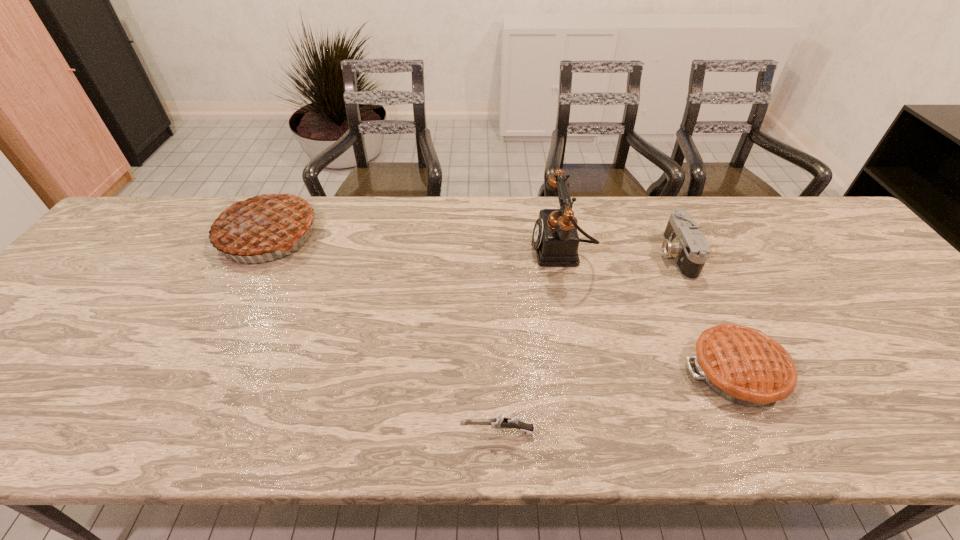
Locate an element on the screen. the farther pie is located at coordinates (261, 223).

Locate an element on the screen. the taller pie is located at coordinates (261, 223).

At what (x,y) coordinates should I click in order to perform the action: click on telephone. Please return your answer as a coordinate pair (x, y). This screenshot has width=960, height=540. Looking at the image, I should click on [556, 240].

This screenshot has height=540, width=960. In order to click on camera in this screenshot , I will do `click(683, 240)`.

Find the location of `the nearer pie`. the nearer pie is located at coordinates (743, 365).

Locate an element on the screen. the second nearest object is located at coordinates (743, 365).

You are a GUI agent. You are given a task and a screenshot of the screen. Output one action in this format:
    pyautogui.click(x=<x>, y=<y>)
    Task: Click on the fourth object from right to left
    The height and width of the screenshot is (540, 960).
    Given the screenshot: What is the action you would take?
    pyautogui.click(x=499, y=422)

Find the location of a particular element. The image size is (960, 540). the shortest object is located at coordinates (499, 422).

What are the coordinates of `vacant space located 0.180m on the left of the taller pie` in the screenshot? It's located at (157, 234).

Identify the location of vacant space located on the front of the third object from right to left at the rotary dial. Image resolution: width=960 pixels, height=540 pixels. (429, 249).